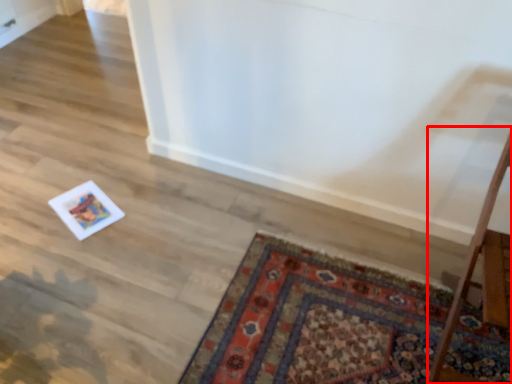
Question: From the image's perspective, what is the correct spatial relationship of table (annotated by the red box) in relation to mat?

Choices:
 (A) above
 (B) below

Answer: (A)